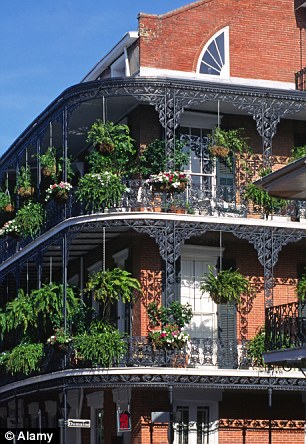
The width and height of the screenshot is (306, 444). I want to click on flower baskets, so click(x=170, y=183), click(x=59, y=192), click(x=9, y=228), click(x=53, y=338), click(x=170, y=339).